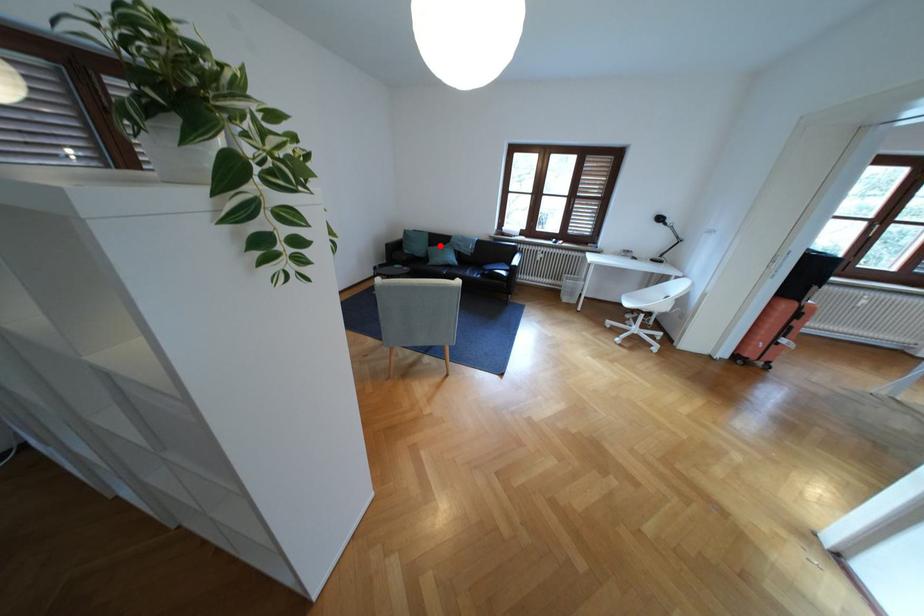
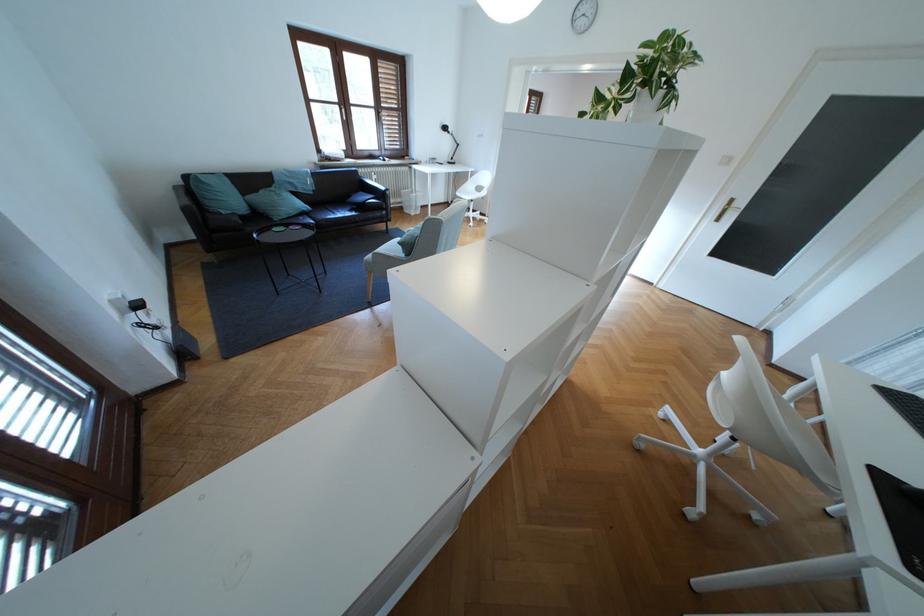
Question: I am providing you with two images of the same scene from different viewpoints. Given a red point in image1, look at the same physical point in image2. Is it:

Choices:
 (A) Closer to the viewpoint
 (B) Farther from the viewpoint

Answer: (B)